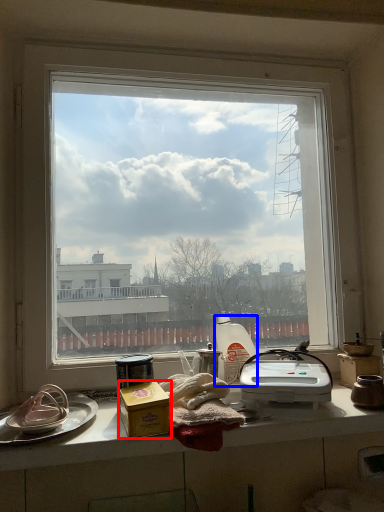
Question: Which object appears farthest to the camera in this image, appliance (highlighted by a red box) or appliance (highlighted by a blue box)?

Choices:
 (A) appliance
 (B) appliance

Answer: (B)